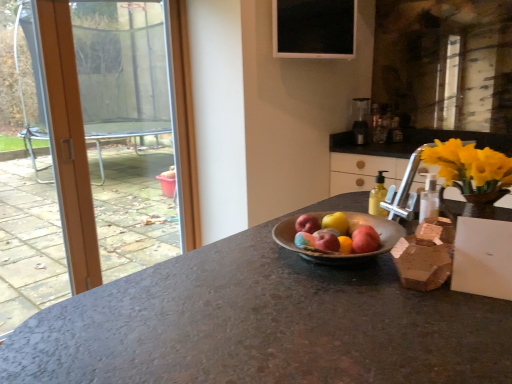
Question: Is the position of matte pink apple at center, acting as the third apple starting from the front, less distant than that of black glass window screen at upper center?

Choices:
 (A) no
 (B) yes

Answer: (B)

Question: Does matte pink apple at center, which appears as the 2th apple when viewed from the back, have a greater width compared to black glass window screen at upper center?

Choices:
 (A) no
 (B) yes

Answer: (A)

Question: Does matte pink apple at center, acting as the third apple starting from the front, have a lesser width compared to black glass window screen at upper center?

Choices:
 (A) no
 (B) yes

Answer: (B)

Question: From the image's perspective, would you say matte pink apple at center, which appears as the 2th apple when viewed from the back, is positioned over black glass window screen at upper center?

Choices:
 (A) no
 (B) yes

Answer: (A)

Question: Considering the relative sizes of matte pink apple at center, which appears as the 2th apple when viewed from the back, and black glass window screen at upper center in the image provided, is matte pink apple at center, which appears as the 2th apple when viewed from the back, shorter than black glass window screen at upper center?

Choices:
 (A) no
 (B) yes

Answer: (B)

Question: Can you confirm if matte pink apple at center, acting as the third apple starting from the front, is smaller than black glass window screen at upper center?

Choices:
 (A) yes
 (B) no

Answer: (A)

Question: From a real-world perspective, is red matte apple at center, the 1th apple from the back, positioned over satin silver blender at upper right based on gravity?

Choices:
 (A) no
 (B) yes

Answer: (A)

Question: Can you confirm if red matte apple at center, arranged as the 4th apple when viewed from the front, is shorter than satin silver blender at upper right?

Choices:
 (A) yes
 (B) no

Answer: (A)

Question: Would you say red matte apple at center, arranged as the 4th apple when viewed from the front, contains satin silver blender at upper right?

Choices:
 (A) yes
 (B) no

Answer: (B)

Question: From a real-world perspective, does red matte apple at center, the 1th apple from the back, sit lower than satin silver blender at upper right?

Choices:
 (A) yes
 (B) no

Answer: (A)

Question: Is red matte apple at center, arranged as the 4th apple when viewed from the front, not inside satin silver blender at upper right?

Choices:
 (A) no
 (B) yes

Answer: (B)

Question: Does red matte apple at center, arranged as the 4th apple when viewed from the front, appear on the right side of satin silver blender at upper right?

Choices:
 (A) yes
 (B) no

Answer: (B)

Question: Is red matte apple at center, the 1th apple from the back, wider than orange wood door at left?

Choices:
 (A) no
 (B) yes

Answer: (B)